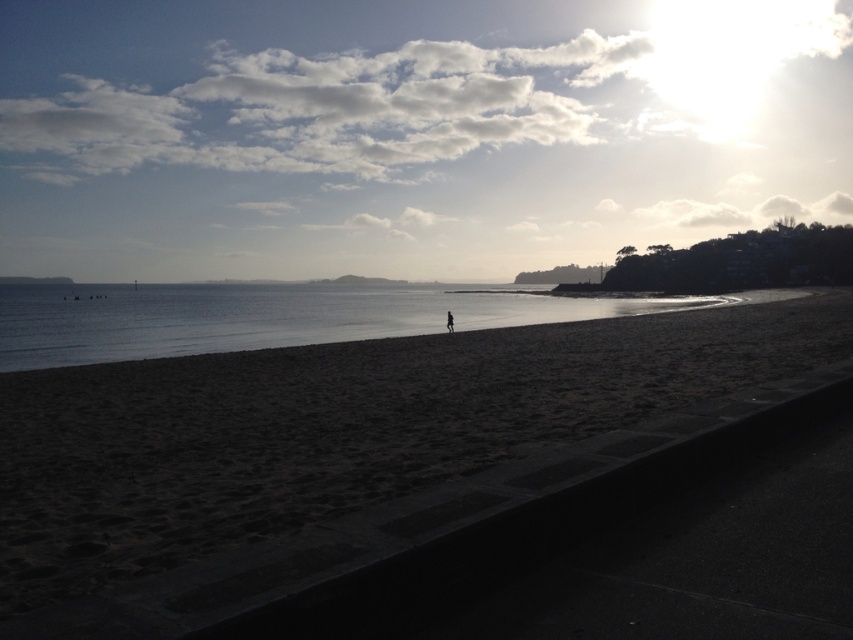
Question: Which object is closer to the camera taking this photo?

Choices:
 (A) dark sand at center
 (B) clear water at center
 (C) black fabric person at center

Answer: (A)

Question: Considering the real-world distances, which object is closest to the dark sand at center?

Choices:
 (A) clear water at center
 (B) black fabric person at center

Answer: (B)

Question: Is dark sand at center to the left of black fabric person at center from the viewer's perspective?

Choices:
 (A) no
 (B) yes

Answer: (B)

Question: Can you confirm if dark sand at center is smaller than black fabric person at center?

Choices:
 (A) yes
 (B) no

Answer: (B)

Question: Where is dark sand at center located in relation to black fabric person at center in the image?

Choices:
 (A) right
 (B) left

Answer: (B)

Question: Which object is closer to the camera taking this photo?

Choices:
 (A) clear water at center
 (B) dark sand at center
 (C) black fabric person at center

Answer: (B)